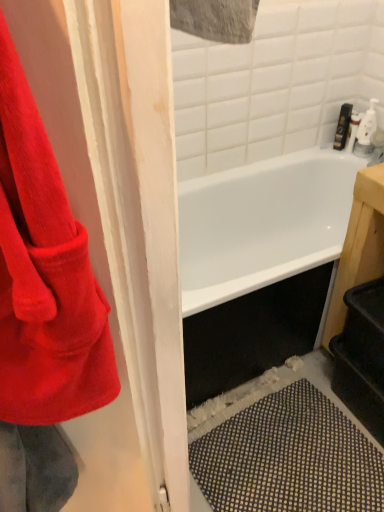
Question: From the image's perspective, is matte black soap dispenser at upper right over corduroy red towel at left?

Choices:
 (A) yes
 (B) no

Answer: (A)

Question: Is matte black soap dispenser at upper right turned away from corduroy red towel at left?

Choices:
 (A) yes
 (B) no

Answer: (B)

Question: From a real-world perspective, is matte black soap dispenser at upper right positioned over corduroy red towel at left based on gravity?

Choices:
 (A) yes
 (B) no

Answer: (B)

Question: Is matte black soap dispenser at upper right to the right of corduroy red towel at left from the viewer's perspective?

Choices:
 (A) yes
 (B) no

Answer: (A)

Question: Considering the relative sizes of matte black soap dispenser at upper right and corduroy red towel at left in the image provided, is matte black soap dispenser at upper right smaller than corduroy red towel at left?

Choices:
 (A) yes
 (B) no

Answer: (A)

Question: Can you confirm if matte black soap dispenser at upper right is positioned to the left of corduroy red towel at left?

Choices:
 (A) yes
 (B) no

Answer: (B)

Question: Considering the relative sizes of corduroy red towel at left and matte black soap dispenser at upper right in the image provided, is corduroy red towel at left taller than matte black soap dispenser at upper right?

Choices:
 (A) yes
 (B) no

Answer: (A)

Question: Can you confirm if corduroy red towel at left is shorter than matte black soap dispenser at upper right?

Choices:
 (A) no
 (B) yes

Answer: (A)

Question: Considering the relative sizes of corduroy red towel at left and matte black soap dispenser at upper right in the image provided, is corduroy red towel at left bigger than matte black soap dispenser at upper right?

Choices:
 (A) no
 (B) yes

Answer: (B)

Question: Can we say corduroy red towel at left lies outside matte black soap dispenser at upper right?

Choices:
 (A) no
 (B) yes

Answer: (B)

Question: Is corduroy red towel at left turned away from matte black soap dispenser at upper right?

Choices:
 (A) yes
 (B) no

Answer: (B)

Question: Considering the relative positions of corduroy red towel at left and matte black soap dispenser at upper right in the image provided, is corduroy red towel at left to the right of matte black soap dispenser at upper right from the viewer's perspective?

Choices:
 (A) yes
 (B) no

Answer: (B)

Question: From a real-world perspective, is matte black soap dispenser at upper right physically located above or below corduroy red towel at left?

Choices:
 (A) below
 (B) above

Answer: (A)